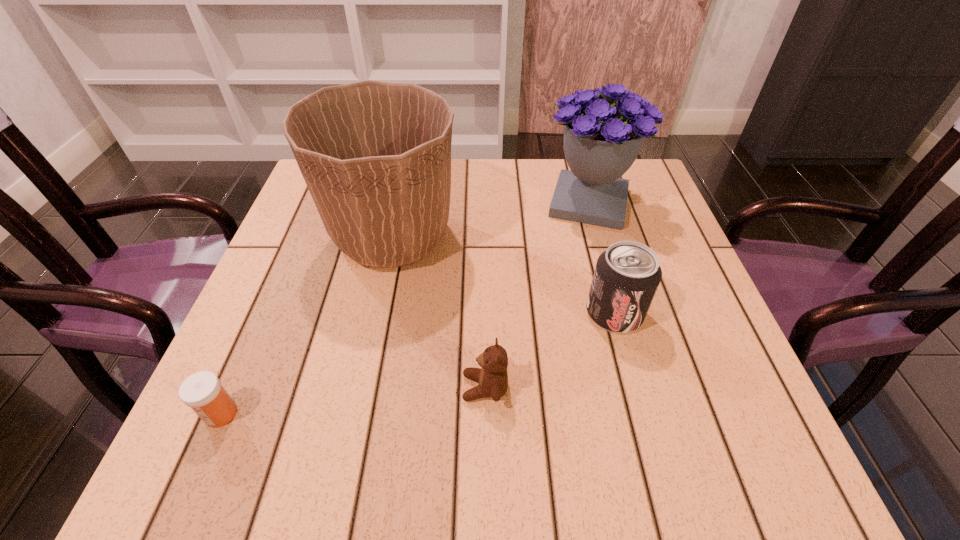
Image resolution: width=960 pixels, height=540 pixels. I want to click on the second object from left to right, so click(x=376, y=156).

The height and width of the screenshot is (540, 960). What are the coordinates of `bouquet` in the screenshot? It's located at (601, 141).

The height and width of the screenshot is (540, 960). Identify the location of soda can. click(626, 277).

Find the location of a particular element. The image size is (960, 540). the third shortest object is located at coordinates (626, 277).

The height and width of the screenshot is (540, 960). Find the location of `the second shortest object`. the second shortest object is located at coordinates (493, 377).

The image size is (960, 540). I want to click on the third object from right to left, so click(x=493, y=377).

The image size is (960, 540). I want to click on medicine, so click(202, 391).

Where is `the leftmost object`? Image resolution: width=960 pixels, height=540 pixels. the leftmost object is located at coordinates (202, 391).

At what (x,y) coordinates should I click in order to perform the action: click on free space located 0.070m on the right of the flowerpot. Please return your answer as a coordinate pair (x, y). Image resolution: width=960 pixels, height=540 pixels. Looking at the image, I should click on (490, 237).

Locate an element on the screen. free space located 0.330m on the front of the bouquet is located at coordinates (633, 355).